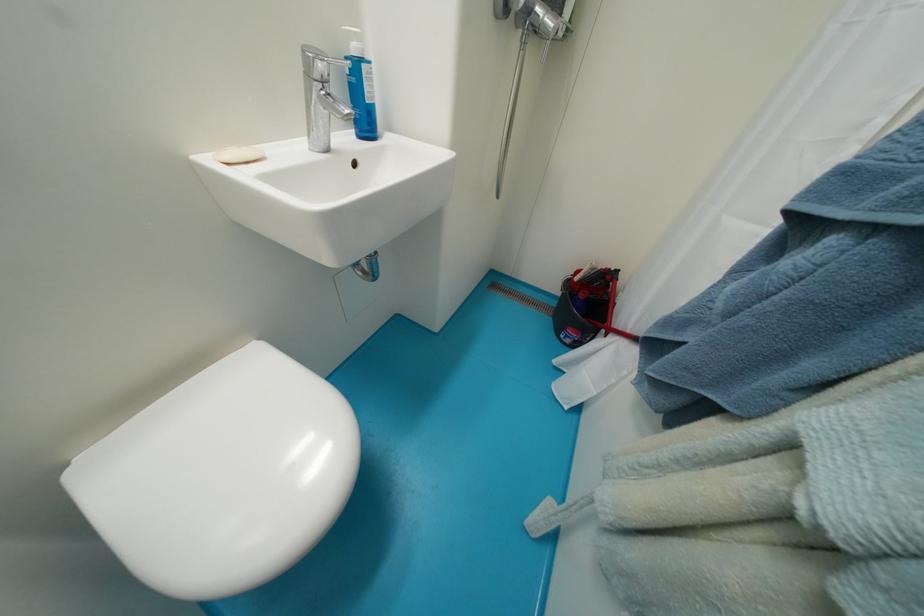
The height and width of the screenshot is (616, 924). Describe the element at coordinates (614, 330) in the screenshot. I see `a red bucket handle` at that location.